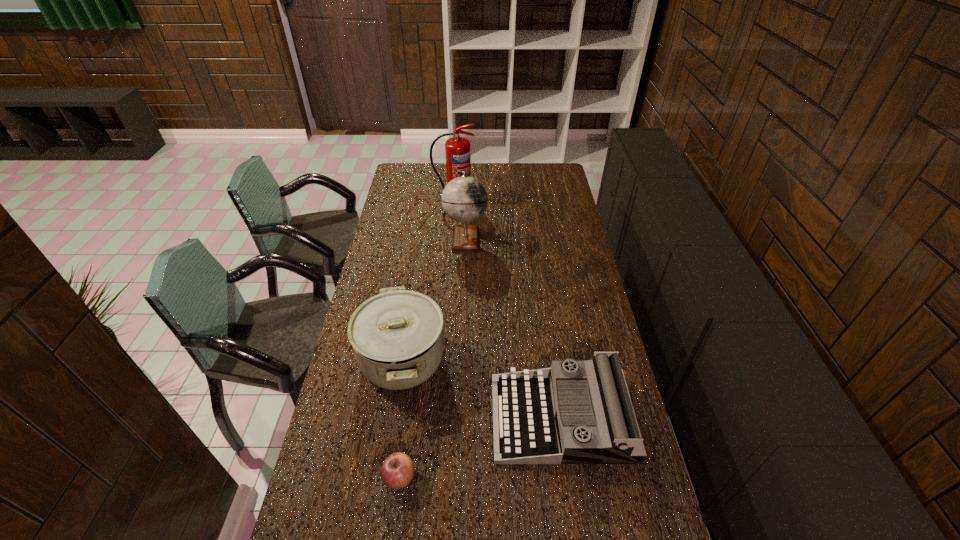
Locate an element on the screen. vacant region located on the back of the saucepan is located at coordinates (414, 288).

Where is `vacant position located 0.320m on the typing side of the second shortest object`? vacant position located 0.320m on the typing side of the second shortest object is located at coordinates (388, 417).

The height and width of the screenshot is (540, 960). I want to click on free location located 0.210m on the typing side of the second shortest object, so click(424, 417).

Locate an element on the screen. The width and height of the screenshot is (960, 540). free space located 0.220m on the typing side of the second shortest object is located at coordinates (420, 417).

The height and width of the screenshot is (540, 960). Identify the location of vacant area situated on the right of the shortest object. (521, 478).

Where is `object that is at the left edge`? object that is at the left edge is located at coordinates (397, 336).

Locate an element on the screen. object located in the right edge section of the desktop is located at coordinates (543, 416).

Find the location of `vacant area at the far edge of the desktop`. vacant area at the far edge of the desktop is located at coordinates (478, 178).

The height and width of the screenshot is (540, 960). In the image, there is a desktop. In order to click on free space at the left edge in this screenshot , I will do `click(348, 457)`.

Find the location of a particular element. The height and width of the screenshot is (540, 960). free space at the right edge of the desktop is located at coordinates (553, 198).